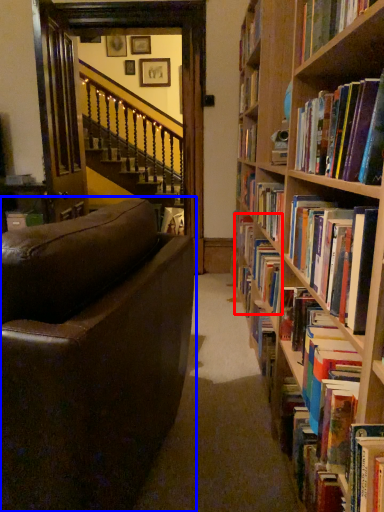
Question: Which point is further to the camera, book (highlighted by a red box) or studio couch (highlighted by a blue box)?

Choices:
 (A) book
 (B) studio couch

Answer: (A)